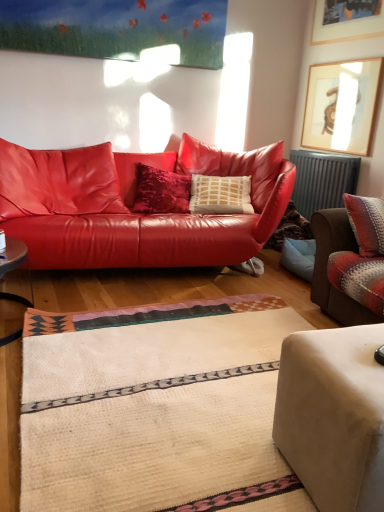
Identify the location of empty space that is ontop of beige fabric ottoman at lower right, acting as the 3th studio couch starting from the back (from a real-world perspective). (360, 352).